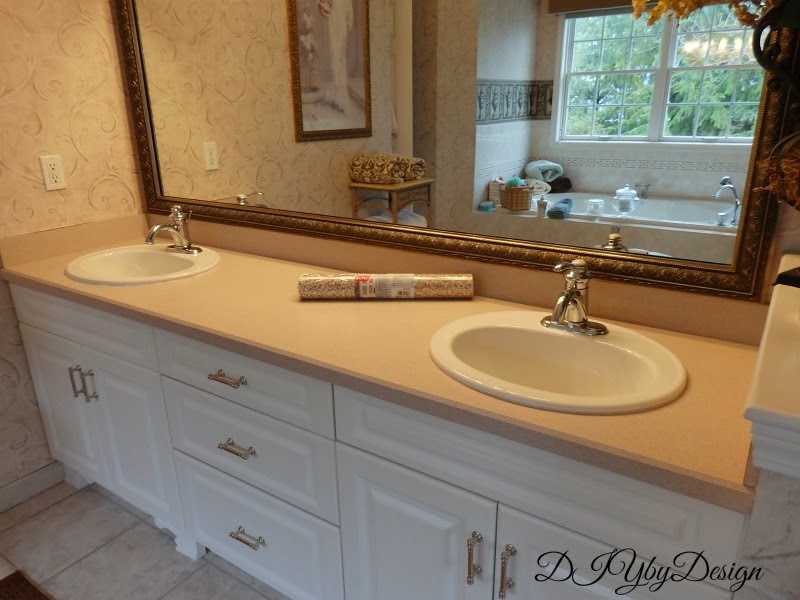
Identify the location of windows. (594, 87), (694, 85).